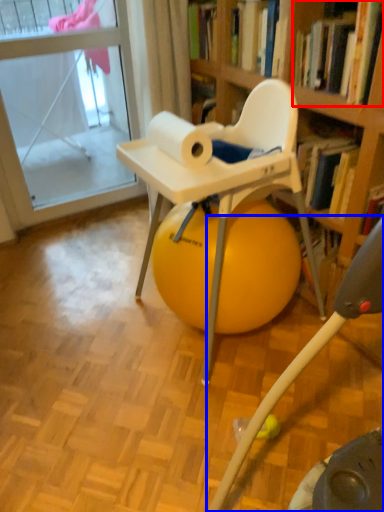
Question: Which point is further to the camera, book (highlighted by a red box) or feeding chair (highlighted by a blue box)?

Choices:
 (A) book
 (B) feeding chair

Answer: (A)